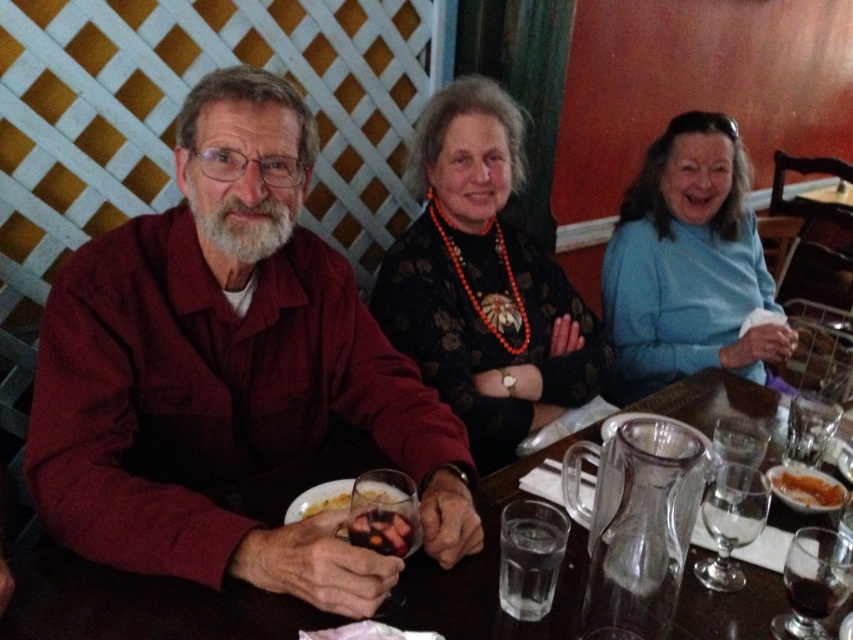
You are a photographer trying to capture the scene. You need to ensure that the black floral dress at center and the dark brown glossy food at lower center are both in focus. Given that the dress is wider than the food, which object should you adjust your camera focus on first to ensure both are in focus?

Since the black floral dress at center is wider than the dark brown glossy food at lower center, you should focus on the black floral dress at center first to ensure both are in focus, as wider objects require more focus adjustment.

Looking at this image, you are a photographer setting up for a group photo. You notice the black floral dress at center and the dark brown glossy food at lower center. Which object should you focus on first to ensure both are in frame without moving the camera?

You should focus on the black floral dress at center first because it is taller than the dark brown glossy food at lower center, ensuring the taller object is centered to include both in the frame.

You are a photographer trying to capture a closeup of the blue soft sweater at upper right and the yellowish matte plate at lower center. Considering their sizes, which one would require you to get closer to the subject to ensure it fills the frame?

The blue soft sweater at upper right is much taller than the yellowish matte plate at lower center, so you would need to get closer to the yellowish matte plate at lower center to ensure it fills the frame since it is smaller.